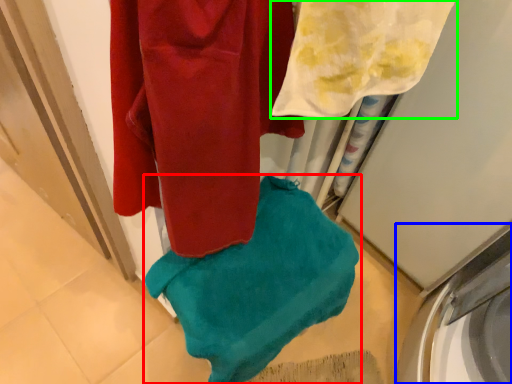
Question: Which is farther away from towel (highlighted by a red box)? washing machine (highlighted by a blue box) or towel (highlighted by a green box)?

Choices:
 (A) washing machine
 (B) towel

Answer: (A)